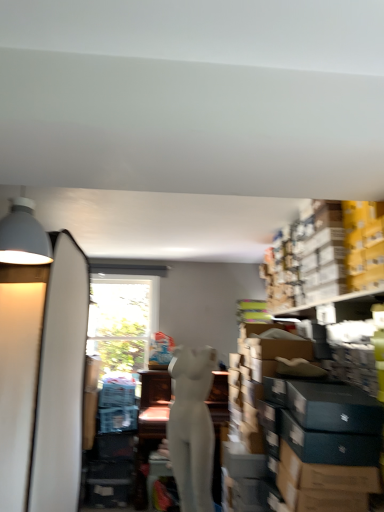
Where is `white matte surfboard at left`? This screenshot has width=384, height=512. white matte surfboard at left is located at coordinates (61, 381).

This screenshot has height=512, width=384. What are the coordinates of `white matte mannequin at center` in the screenshot? It's located at (192, 426).

What do you see at coordinates (23, 236) in the screenshot?
I see `matte gray lampshade at upper left` at bounding box center [23, 236].

Identify the location of white matte surfboard at left. (61, 381).

Is white matte surfboard at left taller than matte gray lampshade at upper left?

Correct, white matte surfboard at left is much taller as matte gray lampshade at upper left.

Consider the image. Can you confirm if white matte surfboard at left is bigger than matte gray lampshade at upper left?

Yes.

Is point (80, 276) behind point (16, 258)?

Yes.

Is matte gray lampshade at upper left bigger or smaller than white matte surfboard at left?

Considering their sizes, matte gray lampshade at upper left takes up less space than white matte surfboard at left.

Is matte gray lampshade at upper left to the right of white matte surfboard at left from the viewer's perspective?

Indeed, matte gray lampshade at upper left is positioned on the right side of white matte surfboard at left.

Is matte gray lampshade at upper left further to the viewer compared to white matte surfboard at left?

Yes, it is.

Where is `surfboard directly beneath the matte gray lampshade at upper left (from a real-world perspective)`? The height and width of the screenshot is (512, 384). surfboard directly beneath the matte gray lampshade at upper left (from a real-world perspective) is located at coordinates (61, 381).

How different are the orientations of matte gray lampshade at upper left and yellow cardboard boxes at upper right in degrees?

84.8 degrees.

From the image's perspective, relative to yellow cardboard boxes at upper right, is matte gray lampshade at upper left above or below?

Clearly, from the image's perspective, matte gray lampshade at upper left is above yellow cardboard boxes at upper right.

Is matte gray lampshade at upper left smaller than yellow cardboard boxes at upper right?

Yes, matte gray lampshade at upper left is smaller than yellow cardboard boxes at upper right.

Is matte gray lampshade at upper left not close to yellow cardboard boxes at upper right?

Absolutely, matte gray lampshade at upper left is distant from yellow cardboard boxes at upper right.

Is the position of white matte surfboard at left more distant than that of white matte mannequin at center?

That is False.

Is there a large distance between white matte surfboard at left and white matte mannequin at center?

No.

From the picture: Is white matte surfboard at left inside the boundaries of white matte mannequin at center, or outside?

white matte surfboard at left lies outside white matte mannequin at center.

Is point (54, 485) positioned before point (177, 480)?

That is True.

From the image's perspective, is yellow cardboard boxes at upper right above or below matte gray lampshade at upper left?

yellow cardboard boxes at upper right is situated lower than matte gray lampshade at upper left in the image.

Can you confirm if yellow cardboard boxes at upper right is positioned to the right of matte gray lampshade at upper left?

Indeed, yellow cardboard boxes at upper right is positioned on the right side of matte gray lampshade at upper left.

Is yellow cardboard boxes at upper right positioned far away from matte gray lampshade at upper left?

Absolutely, yellow cardboard boxes at upper right is distant from matte gray lampshade at upper left.

In the image, is yellow cardboard boxes at upper right positioned in front of or behind matte gray lampshade at upper left?

yellow cardboard boxes at upper right is positioned farther from the viewer than matte gray lampshade at upper left.

Consider the image. Between yellow cardboard boxes at upper right and white matte surfboard at left, which one has larger width?

Wider between the two is white matte surfboard at left.

Is yellow cardboard boxes at upper right positioned far away from white matte surfboard at left?

That's right, there is a large distance between yellow cardboard boxes at upper right and white matte surfboard at left.

Which is behind, yellow cardboard boxes at upper right or white matte surfboard at left?

Positioned behind is yellow cardboard boxes at upper right.

Consider the image. From the image's perspective, is white matte mannequin at center below matte gray lampshade at upper left?

Correct, white matte mannequin at center appears lower than matte gray lampshade at upper left in the image.

Considering the sizes of objects white matte mannequin at center and matte gray lampshade at upper left in the image provided, who is thinner, white matte mannequin at center or matte gray lampshade at upper left?

With smaller width is white matte mannequin at center.

Can you confirm if white matte mannequin at center is positioned to the right of matte gray lampshade at upper left?

Yes.

Where is `lamp above the white matte surfboard at left (from a real-world perspective)`? Image resolution: width=384 pixels, height=512 pixels. lamp above the white matte surfboard at left (from a real-world perspective) is located at coordinates (23, 236).

At what (x,y) coordinates should I click in order to perform the action: click on surfboard on the left of matte gray lampshade at upper left. Please return your answer as a coordinate pair (x, y). The width and height of the screenshot is (384, 512). Looking at the image, I should click on (61, 381).

From the image, which object appears to be nearer to white matte mannequin at center, yellow cardboard boxes at upper right or matte gray lampshade at upper left?

yellow cardboard boxes at upper right is closer to white matte mannequin at center.

Which object lies further to the anchor point white matte surfboard at left, matte gray lampshade at upper left or yellow cardboard boxes at upper right?

yellow cardboard boxes at upper right is further to white matte surfboard at left.

Which object lies further to the anchor point matte gray lampshade at upper left, yellow cardboard boxes at upper right or white matte mannequin at center?

yellow cardboard boxes at upper right is positioned further to the anchor matte gray lampshade at upper left.

Looking at the image, which one is located closer to yellow cardboard boxes at upper right, matte gray lampshade at upper left or white matte surfboard at left?

white matte surfboard at left is positioned closer to the anchor yellow cardboard boxes at upper right.

Looking at the image, which one is located closer to white matte mannequin at center, matte gray lampshade at upper left or yellow cardboard boxes at upper right?

Among the two, yellow cardboard boxes at upper right is located nearer to white matte mannequin at center.

When comparing their distances from white matte mannequin at center, does white matte surfboard at left or matte gray lampshade at upper left seem closer?

white matte surfboard at left lies closer to white matte mannequin at center than the other object.

Looking at the image, which one is located closer to white matte surfboard at left, white matte mannequin at center or matte gray lampshade at upper left?

white matte mannequin at center.

Based on their spatial positions, is white matte mannequin at center or white matte surfboard at left closer to matte gray lampshade at upper left?

Among the two, white matte surfboard at left is located nearer to matte gray lampshade at upper left.

Find the location of a particular element. person between matte gray lampshade at upper left and yellow cardboard boxes at upper right is located at coordinates (192, 426).

The height and width of the screenshot is (512, 384). In order to click on lamp between white matte surfboard at left and yellow cardboard boxes at upper right from left to right in this screenshot , I will do `click(23, 236)`.

Where is `person located between white matte surfboard at left and yellow cardboard boxes at upper right in the left-right direction`? The width and height of the screenshot is (384, 512). person located between white matte surfboard at left and yellow cardboard boxes at upper right in the left-right direction is located at coordinates (192, 426).

Identify the location of surfboard between matte gray lampshade at upper left and white matte mannequin at center from top to bottom. click(x=61, y=381).